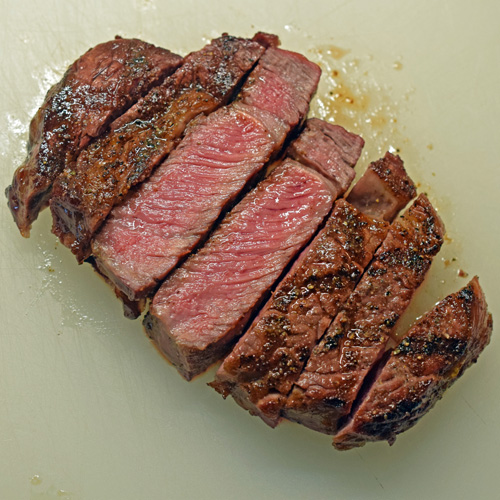
Identify the location of light colored surface. (461, 87).